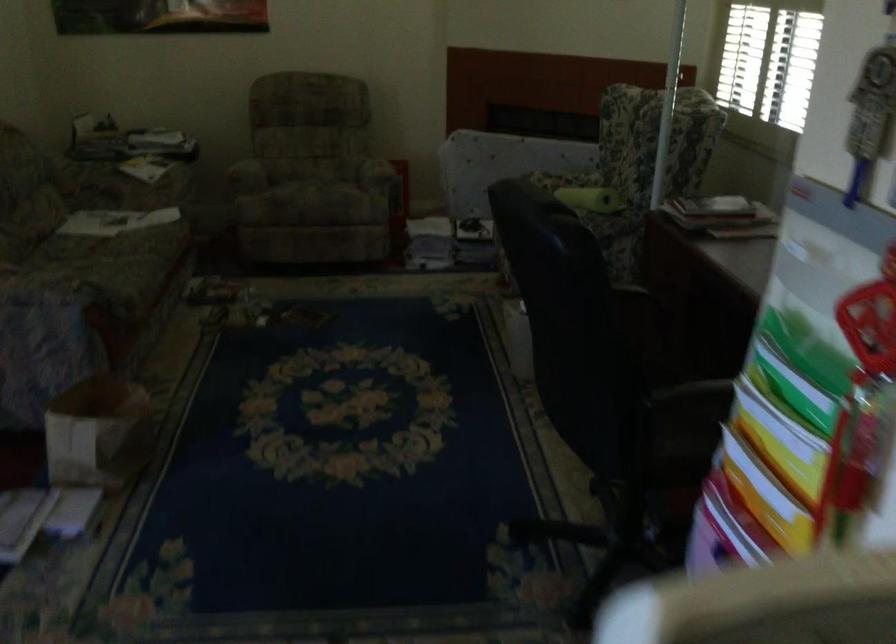
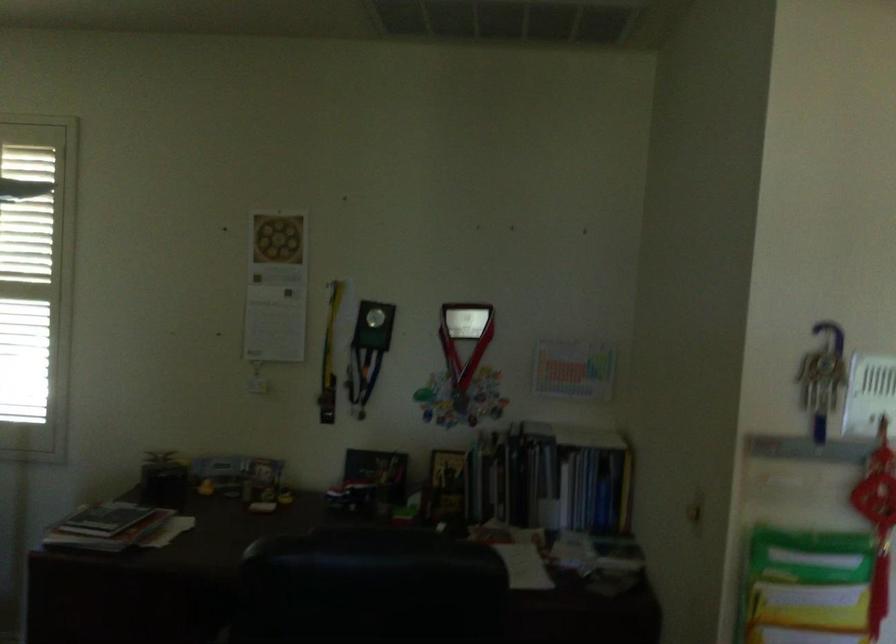
The point at (810,365) is marked in the first image. Where is the corresponding point in the second image?

(814, 558)